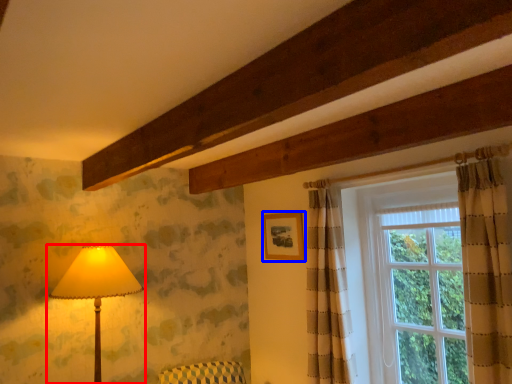
Question: Which object appears farthest to the camera in this image, lamp (highlighted by a red box) or picture frame (highlighted by a blue box)?

Choices:
 (A) lamp
 (B) picture frame

Answer: (B)